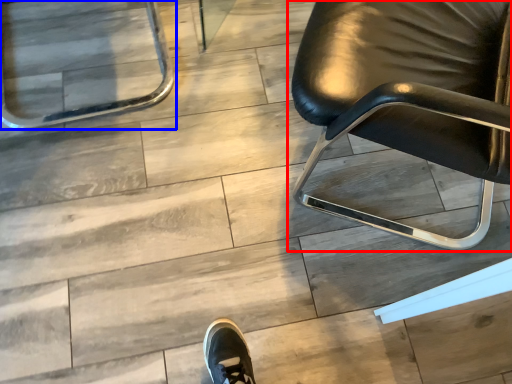
Question: Which object appears farthest to the camera in this image, chair (highlighted by a red box) or chair (highlighted by a blue box)?

Choices:
 (A) chair
 (B) chair

Answer: (B)